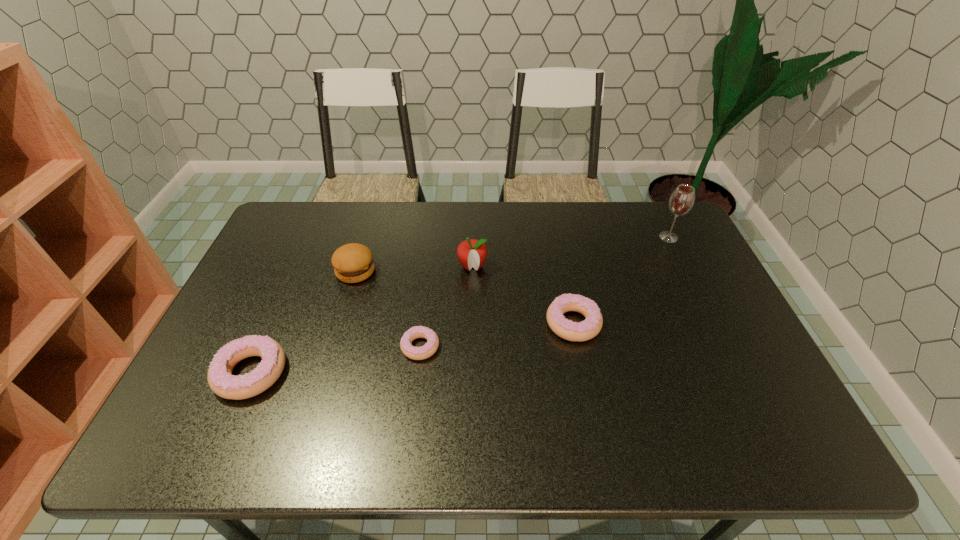
Find the location of a particular element. Image resolution: width=960 pixels, height=540 pixels. object at the right edge is located at coordinates (681, 201).

Find the location of a particular element. This screenshot has width=960, height=540. object that is at the near left corner is located at coordinates (220, 379).

Where is `object positioned at the far right corner`? This screenshot has height=540, width=960. object positioned at the far right corner is located at coordinates (681, 201).

At what (x,y) coordinates should I click in order to perform the action: click on blank space at the far edge of the desktop. Please return your answer as a coordinate pair (x, y). This screenshot has height=540, width=960. Looking at the image, I should click on (597, 238).

Locate an element on the screen. This screenshot has height=540, width=960. vacant area at the near edge is located at coordinates (676, 382).

This screenshot has width=960, height=540. Identify the location of vacant space at the left edge. (302, 249).

The height and width of the screenshot is (540, 960). In order to click on vacant space at the far left corner of the desktop in this screenshot , I will do `click(285, 212)`.

Find the location of a particular element. empty space between the leftmost doughnut and the shortest doughnut is located at coordinates (336, 359).

The height and width of the screenshot is (540, 960). What are the coordinates of `free space between the second object from left to right and the second doughnut from left to right` in the screenshot? It's located at (388, 309).

You are a GUI agent. You are given a task and a screenshot of the screen. Output one action in this format:
    pyautogui.click(x=<x>, y=<y>)
    Task: Click on the free space between the leftmost doughnut and the second object from left to right
    This screenshot has height=540, width=960.
    Given the screenshot: What is the action you would take?
    pyautogui.click(x=303, y=321)